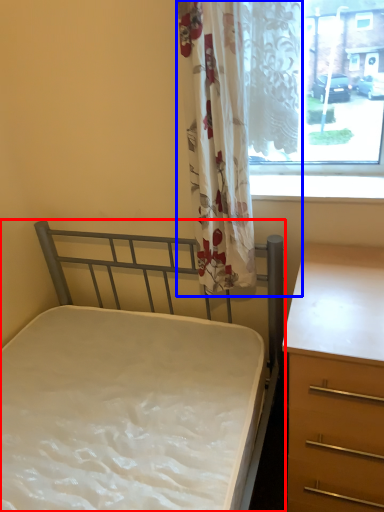
Question: Which object is further to the camera taking this photo, bed (highlighted by a red box) or curtain (highlighted by a blue box)?

Choices:
 (A) bed
 (B) curtain

Answer: (B)